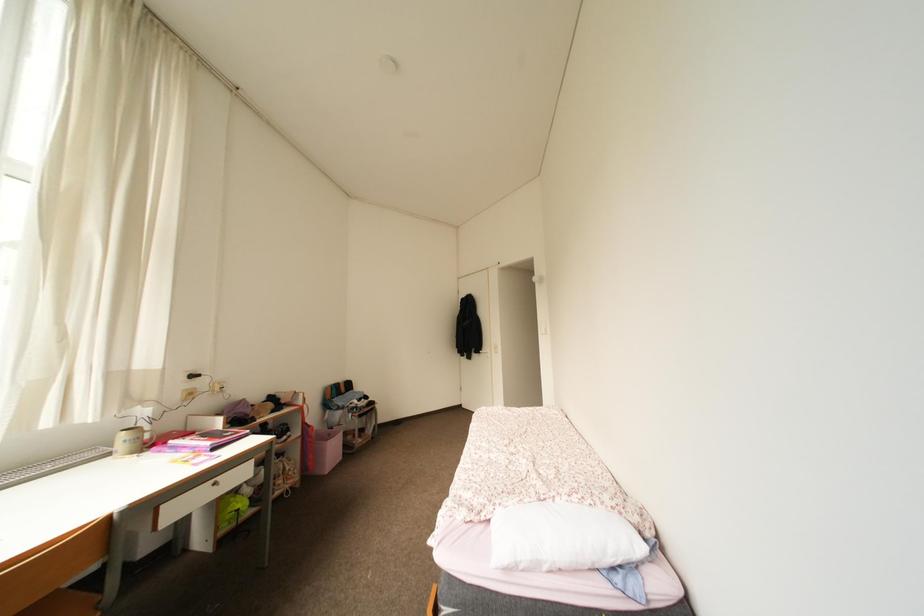
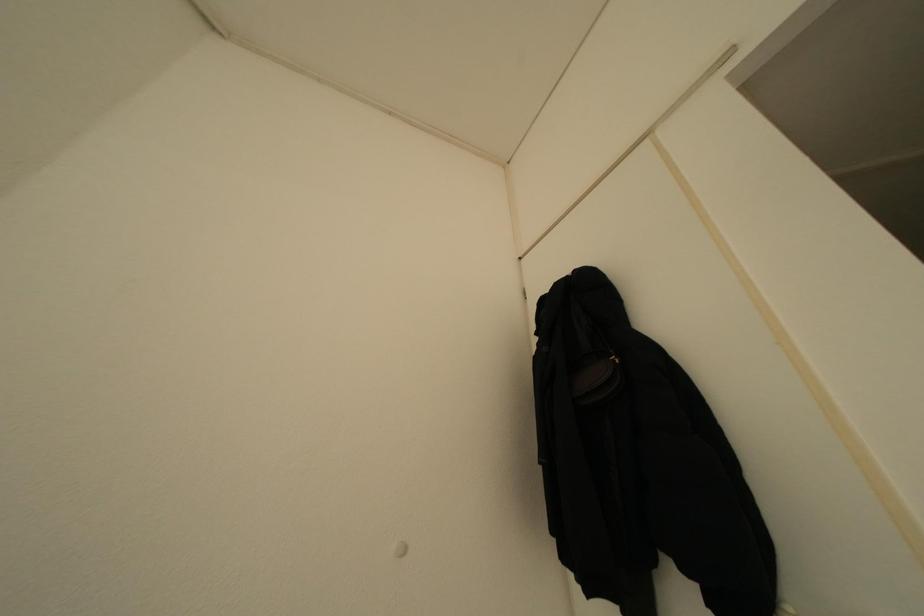
Question: The images are taken continuously from a first-person perspective. In which direction are you moving?

Choices:
 (A) Left
 (B) Right
 (C) Forward
 (D) Backward

Answer: (C)